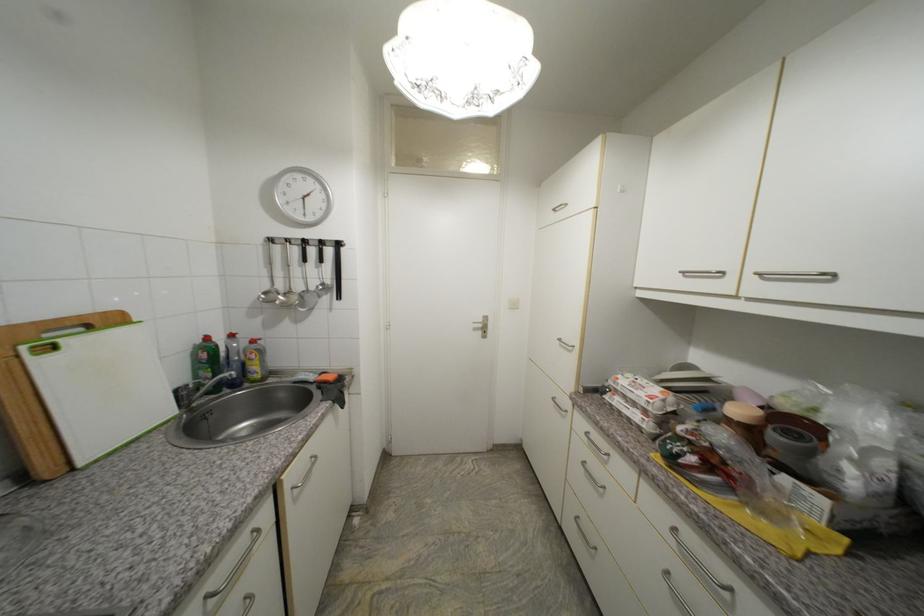
This screenshot has width=924, height=616. I want to click on brown lidded jar, so click(x=746, y=423).